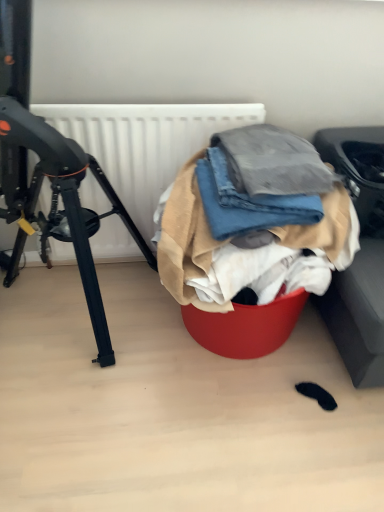
Question: Is denim fabric at center, marked as the third clothing in a top-to-bottom arrangement, completely or partially inside white matte radiator at upper center?

Choices:
 (A) no
 (B) yes

Answer: (A)

Question: From the image's perspective, would you say white matte radiator at upper center is positioned over denim fabric at center, which ranks as the first clothing in bottom-to-top order?

Choices:
 (A) yes
 (B) no

Answer: (A)

Question: Is white matte radiator at upper center thinner than denim fabric at center, which ranks as the first clothing in bottom-to-top order?

Choices:
 (A) yes
 (B) no

Answer: (A)

Question: From the image's perspective, is white matte radiator at upper center located beneath denim fabric at center, which ranks as the first clothing in bottom-to-top order?

Choices:
 (A) no
 (B) yes

Answer: (A)

Question: Can you confirm if white matte radiator at upper center is shorter than denim fabric at center, marked as the third clothing in a top-to-bottom arrangement?

Choices:
 (A) yes
 (B) no

Answer: (B)

Question: Considering the positions of denim fabric at center, which ranks as the first clothing in bottom-to-top order, and denim fabric at center, marked as the first clothing in a top-to-bottom arrangement, in the image, is denim fabric at center, which ranks as the first clothing in bottom-to-top order, taller or shorter than denim fabric at center, marked as the first clothing in a top-to-bottom arrangement,?

Choices:
 (A) short
 (B) tall

Answer: (B)

Question: In terms of size, does denim fabric at center, which ranks as the first clothing in bottom-to-top order, appear bigger or smaller than denim fabric at center, the 3th clothing when ordered from bottom to top?

Choices:
 (A) small
 (B) big

Answer: (B)

Question: Is denim fabric at center, which ranks as the first clothing in bottom-to-top order, spatially inside denim fabric at center, marked as the first clothing in a top-to-bottom arrangement, or outside of it?

Choices:
 (A) outside
 (B) inside

Answer: (A)

Question: Considering the positions of denim fabric at center, marked as the third clothing in a top-to-bottom arrangement, and denim fabric at center, the 3th clothing when ordered from bottom to top, in the image, is denim fabric at center, marked as the third clothing in a top-to-bottom arrangement, wider or thinner than denim fabric at center, the 3th clothing when ordered from bottom to top,?

Choices:
 (A) wide
 (B) thin

Answer: (A)

Question: Is point (221, 258) positioned closer to the camera than point (86, 247)?

Choices:
 (A) farther
 (B) closer

Answer: (B)

Question: Choose the correct answer: Is denim fabric at center, marked as the third clothing in a top-to-bottom arrangement, inside black matte tripod at left or outside it?

Choices:
 (A) inside
 (B) outside

Answer: (B)

Question: Based on their positions, is denim fabric at center, marked as the third clothing in a top-to-bottom arrangement, located to the left or right of black matte tripod at left?

Choices:
 (A) right
 (B) left

Answer: (A)

Question: From the image's perspective, is denim fabric at center, marked as the third clothing in a top-to-bottom arrangement, located above or below black matte tripod at left?

Choices:
 (A) below
 (B) above

Answer: (A)

Question: Looking at the image, does denim fabric at center, marked as the first clothing in a top-to-bottom arrangement, seem bigger or smaller compared to black matte tripod at left?

Choices:
 (A) big
 (B) small

Answer: (B)

Question: From a real-world perspective, is denim fabric at center, the 3th clothing when ordered from bottom to top, above or below black matte tripod at left?

Choices:
 (A) below
 (B) above

Answer: (B)